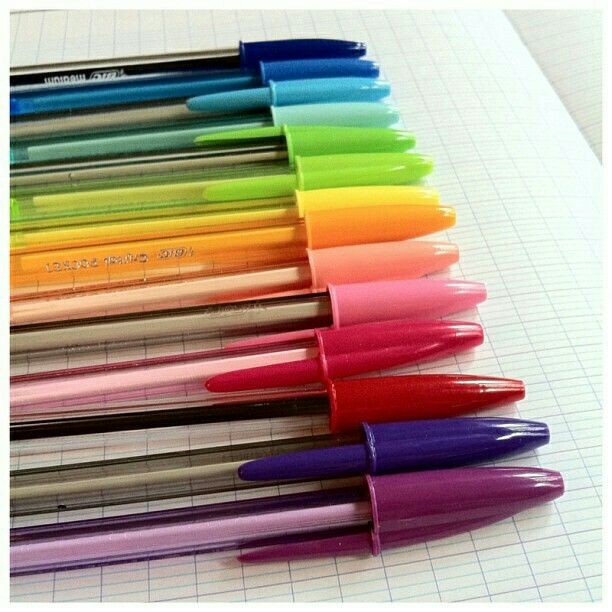
At what (x,y) coordinates should I click in order to perform the action: click on the first 8 pens from the top of the image. Please return your answer as a coordinate pair (x, y). Looking at the image, I should click on (321, 50), (338, 65), (337, 87), (353, 112), (359, 136), (360, 168), (370, 188), (378, 222), (392, 258).